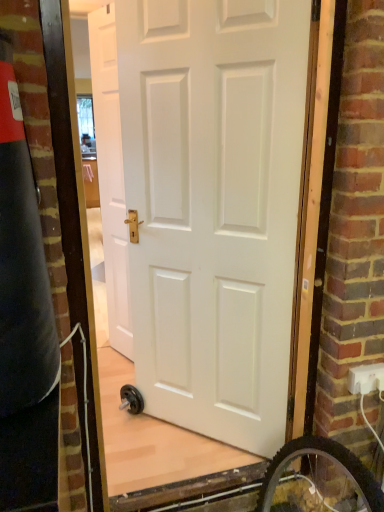
This screenshot has height=512, width=384. What do you see at coordinates (366, 379) in the screenshot?
I see `white plastic electric outlet at lower right` at bounding box center [366, 379].

At what (x,y) coordinates should I click in order to perform the action: click on white matte door at center, arranged as the 1th door when viewed from the right. Please return your answer as a coordinate pair (x, y). The image size is (384, 512). Looking at the image, I should click on (214, 206).

Where is `white matte door at center, which is the second door from right to left`? Image resolution: width=384 pixels, height=512 pixels. white matte door at center, which is the second door from right to left is located at coordinates (111, 175).

At what (x,y) coordinates should I click in order to perform the action: click on white plastic electric outlet at lower right. Please return your answer as a coordinate pair (x, y). Looking at the image, I should click on (366, 379).

Between white matte door at center, which is the first door in left-to-right order, and white matte door at center, the 2th door from the back, which one has larger size?

With larger size is white matte door at center, the 2th door from the back.

Looking at this image, is white matte door at center, the 2th door from the back, at the back of white matte door at center, which is the first door in left-to-right order?

No, white matte door at center, which is the first door in left-to-right order, is not facing away from white matte door at center, the 2th door from the back.

In the scene shown: In terms of height, does white matte door at center, which is the 1th door in back-to-front order, look taller or shorter compared to white matte door at center, the 2th door from the back?

white matte door at center, which is the 1th door in back-to-front order, is taller than white matte door at center, the 2th door from the back.

Does point (383, 380) come closer to viewer compared to point (128, 169)?

That is True.

In terms of height, does white plastic electric outlet at lower right look taller or shorter compared to white matte door at center, which is the 1th door in front-to-back order?

Considering their sizes, white plastic electric outlet at lower right has less height than white matte door at center, which is the 1th door in front-to-back order.

Who is smaller, white plastic electric outlet at lower right or white matte door at center, positioned as the 2th door in left-to-right order?

With smaller size is white plastic electric outlet at lower right.

Is white plastic electric outlet at lower right far from white matte door at center, arranged as the 1th door when viewed from the right?

No, white plastic electric outlet at lower right is not far away from white matte door at center, arranged as the 1th door when viewed from the right.

Can you tell me how much white matte door at center, positioned as the 2th door in left-to-right order, and white matte door at center, arranged as the 2th door when viewed from the front, differ in facing direction?

15.5 degrees.

Between white matte door at center, arranged as the 1th door when viewed from the right, and white matte door at center, arranged as the 2th door when viewed from the front, which one has less height?

white matte door at center, arranged as the 1th door when viewed from the right, is shorter.

Considering the positions of points (261, 424) and (102, 17), is point (261, 424) closer to camera compared to point (102, 17)?

Yes, point (261, 424) is in front of point (102, 17).

In terms of size, does white matte door at center, the 2th door from the back, appear bigger or smaller than white matte door at center, arranged as the 2th door when viewed from the front?

Considering their sizes, white matte door at center, the 2th door from the back, takes up more space than white matte door at center, arranged as the 2th door when viewed from the front.

Is white plastic electric outlet at lower right completely or partially outside of white matte door at center, arranged as the 2th door when viewed from the front?

white plastic electric outlet at lower right is positioned outside white matte door at center, arranged as the 2th door when viewed from the front.

The image size is (384, 512). What are the coordinates of `door that is behind the white plastic electric outlet at lower right` in the screenshot? It's located at coord(111,175).

How many degrees apart are the facing directions of white plastic electric outlet at lower right and white matte door at center, which is the first door in left-to-right order?

They differ by 61 degrees in their facing directions.

From a real-world perspective, is white matte door at center, arranged as the 2th door when viewed from the front, over white plastic electric outlet at lower right?

Yes, from a real-world perspective, white matte door at center, arranged as the 2th door when viewed from the front, is on top of white plastic electric outlet at lower right.

Is white matte door at center, which is the 1th door in back-to-front order, at the left side of white plastic electric outlet at lower right?

Yes, white matte door at center, which is the 1th door in back-to-front order, is to the left of white plastic electric outlet at lower right.

Is white matte door at center, which is the second door from right to left, beside white plastic electric outlet at lower right?

No, white matte door at center, which is the second door from right to left, is not touching white plastic electric outlet at lower right.

Looking at this image, is white plastic electric outlet at lower right completely or partially inside white matte door at center, which is the first door in left-to-right order?

No, white plastic electric outlet at lower right is not surrounded by white matte door at center, which is the first door in left-to-right order.

Can you confirm if white matte door at center, arranged as the 1th door when viewed from the right, is thinner than white plastic electric outlet at lower right?

In fact, white matte door at center, arranged as the 1th door when viewed from the right, might be wider than white plastic electric outlet at lower right.

Based on the photo, is white matte door at center, which is the 1th door in front-to-back order, at the left side of white plastic electric outlet at lower right?

Yes.

Is white matte door at center, the 2th door from the back, touching white plastic electric outlet at lower right?

white matte door at center, the 2th door from the back, and white plastic electric outlet at lower right are clearly separated.

Is white matte door at center, which is the 1th door in front-to-back order, aimed at white plastic electric outlet at lower right?

No, white matte door at center, which is the 1th door in front-to-back order, is not aimed at white plastic electric outlet at lower right.

Where is `door lying behind the white matte door at center, the 2th door from the back`? This screenshot has height=512, width=384. door lying behind the white matte door at center, the 2th door from the back is located at coordinates (111, 175).

Locate an element on the screen. The image size is (384, 512). the 1st door to the left when counting from the white plastic electric outlet at lower right is located at coordinates (214, 206).

Which object lies further to the anchor point white matte door at center, which is the first door in left-to-right order, white matte door at center, arranged as the 1th door when viewed from the right, or white plastic electric outlet at lower right?

The object further to white matte door at center, which is the first door in left-to-right order, is white plastic electric outlet at lower right.

Considering their positions, is white matte door at center, which is the first door in left-to-right order, positioned further to white matte door at center, which is the 1th door in front-to-back order, than white plastic electric outlet at lower right?

white plastic electric outlet at lower right.

Estimate the real-world distances between objects in this image. Which object is closer to white matte door at center, positioned as the 2th door in left-to-right order, white plastic electric outlet at lower right or white matte door at center, which is the 1th door in back-to-front order?

Based on the image, white matte door at center, which is the 1th door in back-to-front order, appears to be nearer to white matte door at center, positioned as the 2th door in left-to-right order.

When comparing their distances from white plastic electric outlet at lower right, does white matte door at center, which is the first door in left-to-right order, or white matte door at center, which is the 1th door in front-to-back order, seem closer?

Among the two, white matte door at center, which is the 1th door in front-to-back order, is located nearer to white plastic electric outlet at lower right.

Looking at the image, which one is located further to white plastic electric outlet at lower right, white matte door at center, arranged as the 1th door when viewed from the right, or white matte door at center, arranged as the 2th door when viewed from the front?

white matte door at center, arranged as the 2th door when viewed from the front, is further to white plastic electric outlet at lower right.

Based on their spatial positions, is white plastic electric outlet at lower right or white matte door at center, the 2th door from the back, closer to white matte door at center, arranged as the 2th door when viewed from the front?

The object closer to white matte door at center, arranged as the 2th door when viewed from the front, is white matte door at center, the 2th door from the back.

Identify the location of door between white matte door at center, arranged as the 2th door when viewed from the front, and white plastic electric outlet at lower right from left to right. Image resolution: width=384 pixels, height=512 pixels. (214, 206).